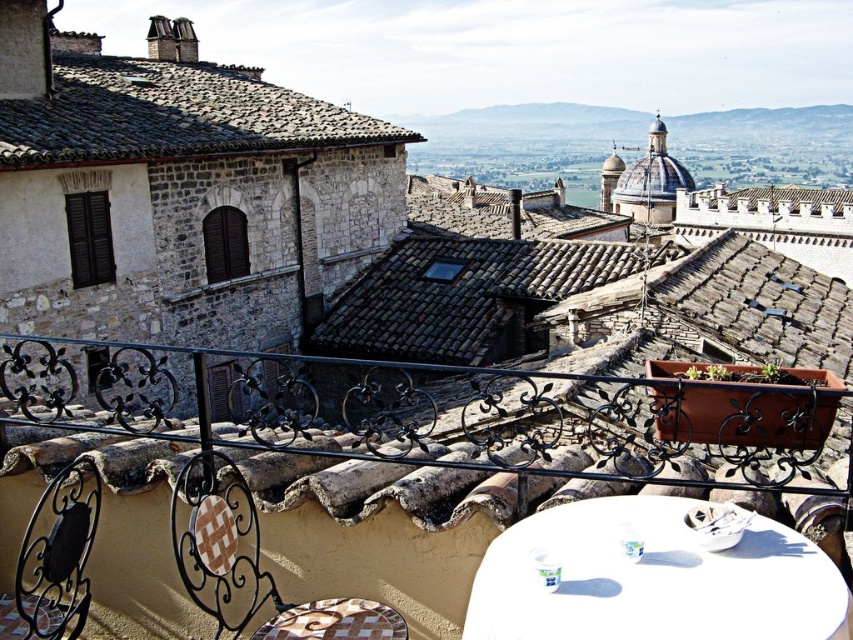
Is white glossy table at lower right thinner than brown tiled roof at upper left?

Indeed, white glossy table at lower right has a lesser width compared to brown tiled roof at upper left.

Can you confirm if white glossy table at lower right is bigger than brown tiled roof at upper left?

No.

Is point (605, 547) farther from viewer compared to point (236, 81)?

No, (605, 547) is closer to viewer.

Locate an element on the screen. The image size is (853, 640). white glossy table at lower right is located at coordinates (651, 579).

Does brown tiled roof at upper left have a greater height compared to brown woven chair at lower left?

Correct, brown tiled roof at upper left is much taller as brown woven chair at lower left.

Is point (77, 68) less distant than point (308, 628)?

No, (77, 68) is behind (308, 628).

What do you see at coordinates (169, 113) in the screenshot? The image size is (853, 640). I see `brown tiled roof at upper left` at bounding box center [169, 113].

Locate an element on the screen. Image resolution: width=853 pixels, height=640 pixels. brown tiled roof at upper left is located at coordinates (169, 113).

Is point (561, 432) less distant than point (541, 604)?

No, (561, 432) is further to viewer.

Does black wrought iron railing at center have a larger size compared to white glossy table at lower right?

Indeed, black wrought iron railing at center has a larger size compared to white glossy table at lower right.

What are the coordinates of `black wrought iron railing at center` in the screenshot? It's located at (410, 404).

This screenshot has width=853, height=640. I want to click on black wrought iron railing at center, so click(x=410, y=404).